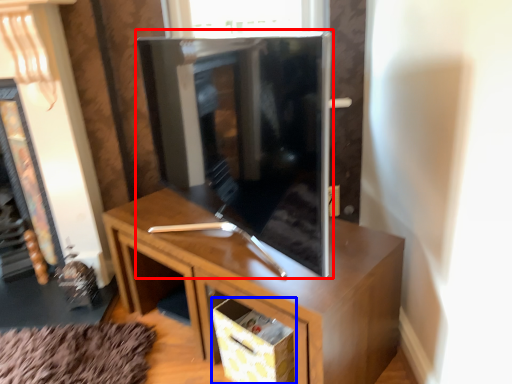
Question: Which of the following is the closest to the observer, tv cabinet (highlighted by a red box) or drawer (highlighted by a blue box)?

Choices:
 (A) tv cabinet
 (B) drawer

Answer: (A)